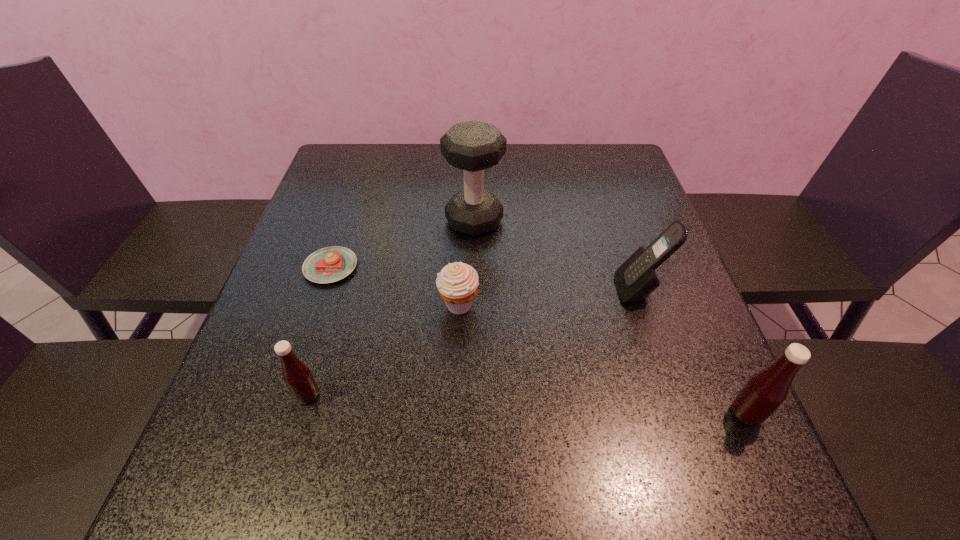
To make them evenly spaced by inserting another Tabasco_sauce among them, please locate a vacant spot for this new Tabasco_sauce. Please provide its 2D coordinates. Your answer should be formatted as a tuple, i.e. [(x, y)], where the tuple contains the x and y coordinates of a point satisfying the conditions above.

[(523, 404)]